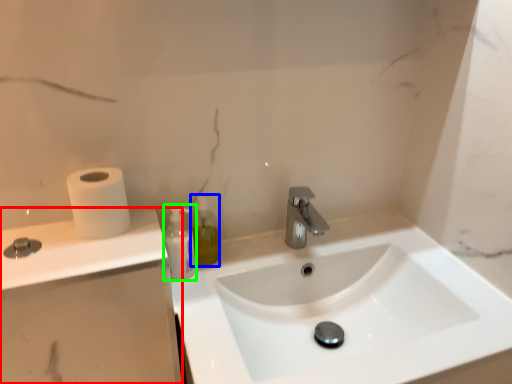
Question: Based on their relative distances, which object is nearer to counter top (highlighted by a red box)? Choose from soap dispenser (highlighted by a blue box) and mouthwash (highlighted by a green box).

Choices:
 (A) soap dispenser
 (B) mouthwash

Answer: (B)